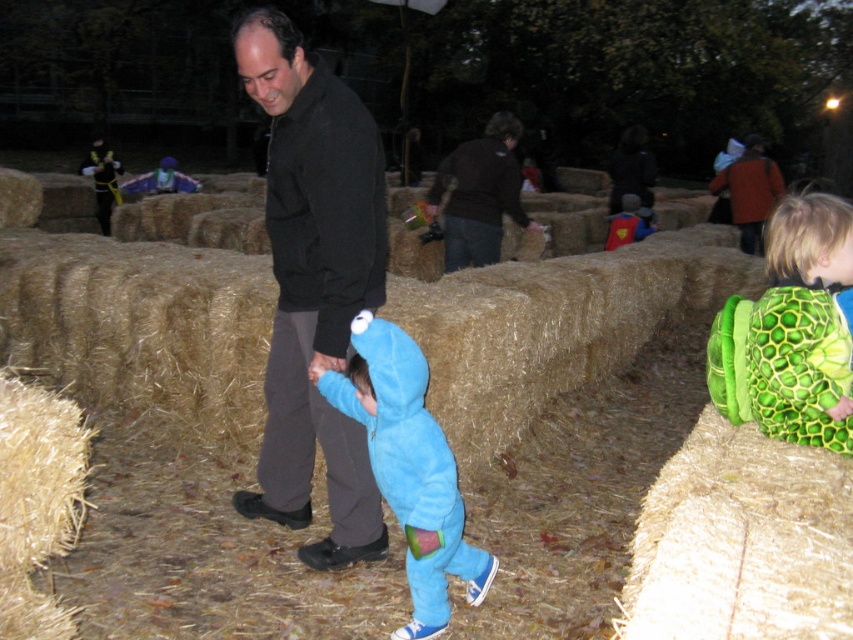
Question: Which of the following is the closest to the observer?

Choices:
 (A) blue fuzzy onesie at center
 (B) green textured backpack at right

Answer: (B)

Question: Which of the following is the farthest from the observer?

Choices:
 (A) blue fuzzy onesie at center
 (B) black soft jacket at center
 (C) dark brown leather jacket at upper center
 (D) green textured backpack at right

Answer: (C)

Question: Which of these objects is positioned closest to the green textured backpack at right?

Choices:
 (A) blue fuzzy onesie at center
 (B) dark brown leather jacket at upper center
 (C) black soft jacket at center

Answer: (A)

Question: Does blue fuzzy onesie at center appear under dark brown leather jacket at upper center?

Choices:
 (A) no
 (B) yes

Answer: (B)

Question: From the image, what is the correct spatial relationship of black soft jacket at center in relation to blue fuzzy onesie at center?

Choices:
 (A) above
 (B) below

Answer: (A)

Question: Does blue fuzzy onesie at center appear on the right side of dark brown leather jacket at upper center?

Choices:
 (A) no
 (B) yes

Answer: (A)